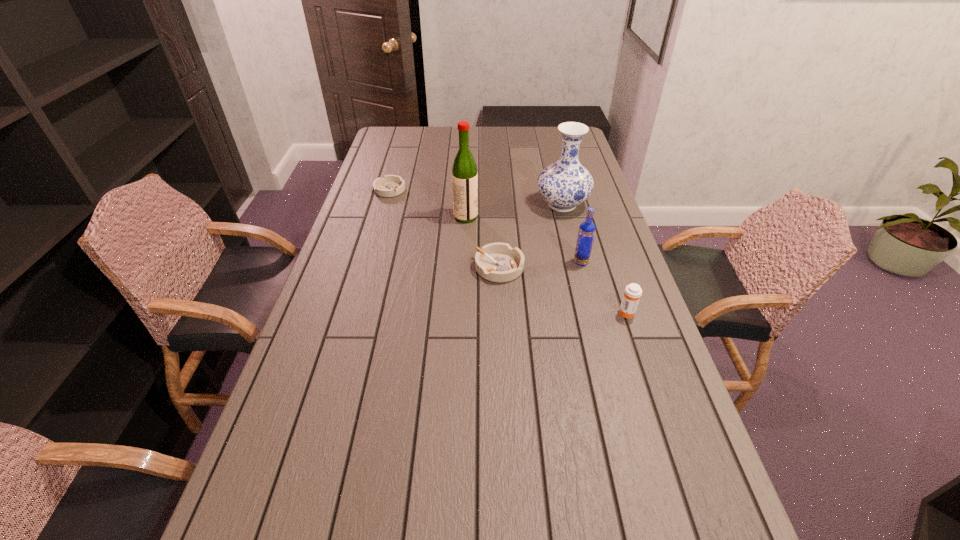
In the image, there is a desktop. At what (x,y) coordinates should I click in order to perform the action: click on free space at the left edge. Please return your answer as a coordinate pair (x, y). This screenshot has width=960, height=540. Looking at the image, I should click on (386, 213).

Locate an element on the screen. The width and height of the screenshot is (960, 540). free space at the right edge of the desktop is located at coordinates (615, 251).

Where is `free location at the far left corner of the desktop`? This screenshot has width=960, height=540. free location at the far left corner of the desktop is located at coordinates (410, 131).

Find the location of a particular element. This screenshot has height=540, width=960. free space at the near right corner of the desktop is located at coordinates (664, 480).

Find the location of a particular element. The image size is (960, 540). vacant area that lies between the farther ashtray and the liquor is located at coordinates (428, 203).

This screenshot has width=960, height=540. What are the coordinates of `vacant point located between the vodka and the nearer ashtray` in the screenshot? It's located at (540, 265).

I want to click on free spot between the liquor and the vodka, so click(x=523, y=239).

Find the location of `free space between the taller ashtray and the liquor`. free space between the taller ashtray and the liquor is located at coordinates (483, 242).

The height and width of the screenshot is (540, 960). What are the coordinates of `vacant region between the vodka and the liquor` in the screenshot? It's located at (523, 239).

The height and width of the screenshot is (540, 960). In order to click on free area in between the liquor and the farther ashtray in this screenshot , I will do `click(428, 203)`.